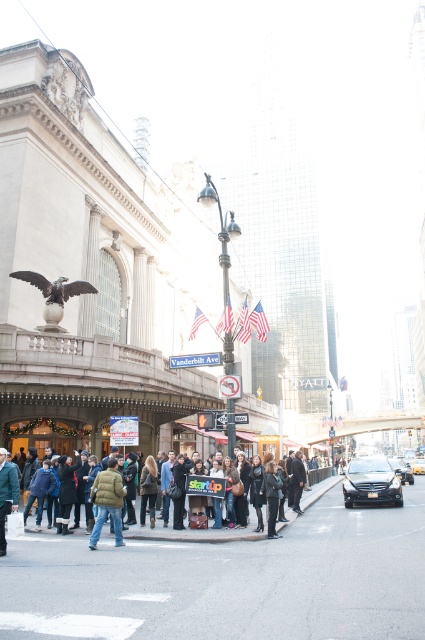
Consider the image. You are a delivery person trying to park your 1.8 meter wide van. You see a space between the black metallic car at center and the shiny bronze eagle at center. Can your van fit there?

The black metallic car at center might be wider than the shiny bronze eagle at center, so the space between them may not be wide enough for your 1.8 meter wide van. Check the width carefully before attempting to park.

Based on the scene description and the objects provided, what is the color and location of the object at point coordinates (229,580)?

The object at point coordinates (229,580) is dark gray asphalt located at the lower center of the image.

You are a pedestrian standing at the street corner. You see a black metallic car at center and a shiny bronze eagle at center. Which object is positioned higher from the ground?

The shiny bronze eagle at center is positioned higher from the ground than the black metallic car at center.